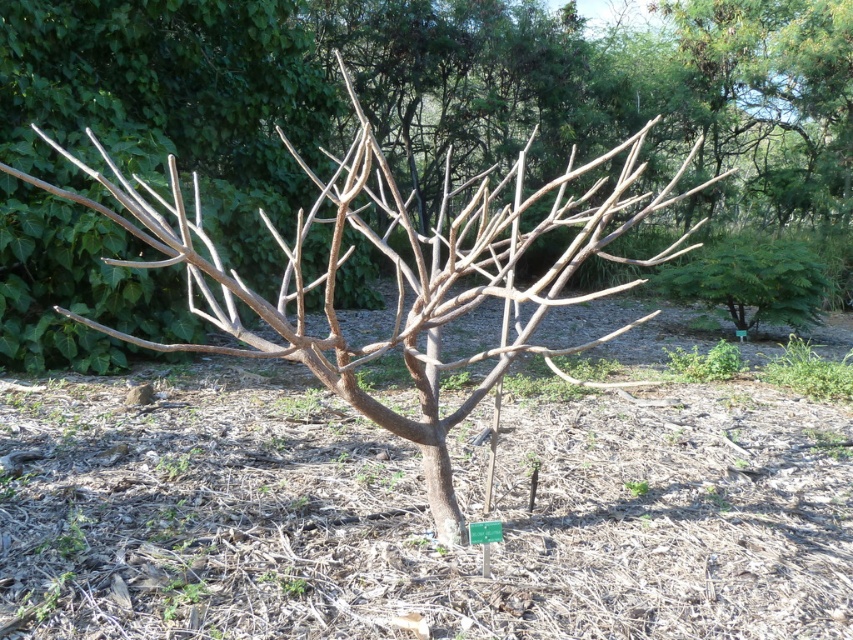
You are a gardener who needs to determine which object is larger between the green leafy plant at lower right and the brown woody branch at center. Based on the scene, which one is bigger?

The green leafy plant at lower right is bigger than the brown woody branch at center.

You are standing at the base of the tree and see the point marked at coordinates point (416, 515). What is located at that point?

The point (416, 515) indicates brown dirt at center.